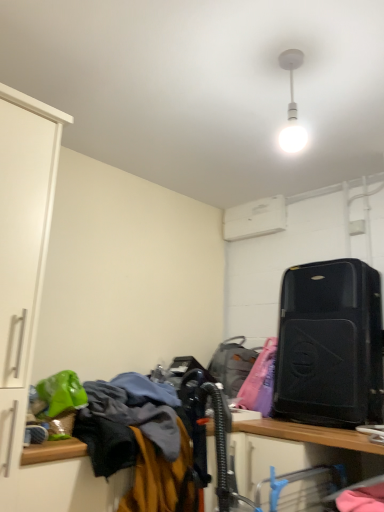
This screenshot has width=384, height=512. In order to click on black matte suitcase at right in this screenshot , I will do `click(330, 345)`.

This screenshot has height=512, width=384. Describe the element at coordinates (292, 106) in the screenshot. I see `white matte light bulb at upper center` at that location.

Where is `metallic silver computer desk at lower center`? This screenshot has height=512, width=384. metallic silver computer desk at lower center is located at coordinates (299, 450).

What is the approximate height of wooden desk at lower center?

The height of wooden desk at lower center is 27.22 inches.

Describe the element at coordinates (255, 384) in the screenshot. The image size is (384, 512). I see `textured fabric laundry at lower left` at that location.

You are a GUI agent. You are given a task and a screenshot of the screen. Output one action in this format:
    pyautogui.click(x=<x>, y=<y>)
    Task: Click on the white plastic air conditioner at upper center
    The height and width of the screenshot is (512, 384).
    Given the screenshot: What is the action you would take?
    pyautogui.click(x=255, y=218)

Identify the location of black matte suitcase at right. This screenshot has width=384, height=512. (330, 345).

Image resolution: width=384 pixels, height=512 pixels. Find the location of `laundry lying below the white plastic air conditioner at upper center (from the image's perspective)`. laundry lying below the white plastic air conditioner at upper center (from the image's perspective) is located at coordinates (255, 384).

Which of these two, textured fabric laundry at lower left or white plastic air conditioner at upper center, stands shorter?

white plastic air conditioner at upper center is shorter.

Is point (43, 448) farther from camera compared to point (271, 219)?

No, it is not.

From the picture: How distant is matte black suitcase at center right from wooden desk at lower center?

matte black suitcase at center right is 60.53 centimeters from wooden desk at lower center.

Is matte black suitcase at center right facing away from wooden desk at lower center?

No, wooden desk at lower center is not at the back of matte black suitcase at center right.

How different are the orientations of matte black suitcase at center right and wooden desk at lower center in degrees?

8.85 degrees.

From the image's perspective, is matte black suitcase at center right located above or below wooden desk at lower center?

From the image's perspective, matte black suitcase at center right appears above wooden desk at lower center.

Would you consider matte black suitcase at center right to be distant from metallic silver computer desk at lower center?

No.

Image resolution: width=384 pixels, height=512 pixels. What are the coordinates of `luggage and bags behind the metallic silver computer desk at lower center` in the screenshot? It's located at (232, 364).

Could you measure the distance between matte black suitcase at center right and metallic silver computer desk at lower center?

matte black suitcase at center right and metallic silver computer desk at lower center are 24.18 inches apart from each other.

Which is closer to the camera, [234,390] or [259,462]?

Positioned in front is point [259,462].

From their relative heights in the image, would you say white matte light bulb at upper center is taller or shorter than white plastic air conditioner at upper center?

Considering their sizes, white matte light bulb at upper center has more height than white plastic air conditioner at upper center.

Are white matte light bulb at upper center and white plastic air conditioner at upper center beside each other?

white matte light bulb at upper center and white plastic air conditioner at upper center are not in contact.

Is white matte light bulb at upper center to the left or to the right of white plastic air conditioner at upper center in the image?

white matte light bulb at upper center is positioned on white plastic air conditioner at upper center's left side.

Is point (291, 66) closer to viewer compared to point (269, 217)?

Yes, point (291, 66) is in front of point (269, 217).

Can you see black matte suitcase at right touching white matte light bulb at upper center?

No.

Considering the points (345, 291) and (284, 136), which point is behind, point (345, 291) or point (284, 136)?

The point (345, 291) is behind.

Is black matte suitcase at right looking in the opposite direction of white matte light bulb at upper center?

No.

Considering the relative sizes of white plastic air conditioner at upper center and black matte suitcase at right in the image provided, is white plastic air conditioner at upper center bigger than black matte suitcase at right?

No.

What's the angular difference between white plastic air conditioner at upper center and black matte suitcase at right's facing directions?

There is a 3.45-degree angle between the facing directions of white plastic air conditioner at upper center and black matte suitcase at right.

Which object is closer to the camera, white plastic air conditioner at upper center or black matte suitcase at right?

black matte suitcase at right is more forward.

Is white plastic air conditioner at upper center to the left of black matte suitcase at right from the viewer's perspective?

Yes.

From the image's perspective, who appears lower, white plastic air conditioner at upper center or matte black suitcase at center right?

matte black suitcase at center right appears lower in the image.

Consider the image. Is white plastic air conditioner at upper center next to matte black suitcase at center right?

No, white plastic air conditioner at upper center is not in contact with matte black suitcase at center right.

Does white plastic air conditioner at upper center turn towards matte black suitcase at center right?

No, white plastic air conditioner at upper center is not aimed at matte black suitcase at center right.

Measure the distance from white plastic air conditioner at upper center to matte black suitcase at center right.

white plastic air conditioner at upper center is 34.79 inches away from matte black suitcase at center right.

The height and width of the screenshot is (512, 384). What are the coordinates of `laundry on the left of the white plastic air conditioner at upper center` in the screenshot? It's located at (255, 384).

Where is `desk in front of the matte black suitcase at center right`? desk in front of the matte black suitcase at center right is located at coordinates (309, 434).

Which object lies further to the anchor point black matte suitcase at right, metallic silver computer desk at lower center or textured fabric laundry at lower left?

metallic silver computer desk at lower center is positioned further to the anchor black matte suitcase at right.

Which object lies nearer to the anchor point wooden desk at lower center, white matte light bulb at upper center or black matte suitcase at right?

black matte suitcase at right is positioned closer to the anchor wooden desk at lower center.

Looking at the image, which one is located closer to white matte light bulb at upper center, wooden desk at lower center or textured fabric laundry at lower left?

Based on the image, textured fabric laundry at lower left appears to be nearer to white matte light bulb at upper center.

Based on their spatial positions, is matte black suitcase at center right or black matte suitcase at right further from wooden desk at lower center?

matte black suitcase at center right.

Which object lies nearer to the anchor point metallic silver computer desk at lower center, wooden desk at lower center or textured fabric laundry at lower left?

wooden desk at lower center is positioned closer to the anchor metallic silver computer desk at lower center.

Based on the photo, estimate the real-world distances between objects in this image. Which object is further from textured fabric laundry at lower left, white plastic air conditioner at upper center or wooden desk at lower center?

white plastic air conditioner at upper center is further to textured fabric laundry at lower left.

Based on their spatial positions, is textured fabric laundry at lower left or matte black suitcase at center right closer to wooden desk at lower center?

textured fabric laundry at lower left lies closer to wooden desk at lower center than the other object.

Based on their spatial positions, is black matte suitcase at right or textured fabric laundry at lower left further from white matte light bulb at upper center?

Based on the image, textured fabric laundry at lower left appears to be further to white matte light bulb at upper center.

Where is `luggage & bags between wooden desk at lower center and white plastic air conditioner at upper center from front to back`? This screenshot has width=384, height=512. luggage & bags between wooden desk at lower center and white plastic air conditioner at upper center from front to back is located at coordinates (330, 345).

Locate an element on the screen. computer desk located between wooden desk at lower center and black matte suitcase at right in the depth direction is located at coordinates (299, 450).

Find the location of a particular element. The width and height of the screenshot is (384, 512). laundry between wooden desk at lower center and white plastic air conditioner at upper center along the z-axis is located at coordinates (255, 384).

Identify the location of luggage and bags between white matte light bulb at upper center and white plastic air conditioner at upper center from front to back. (232, 364).